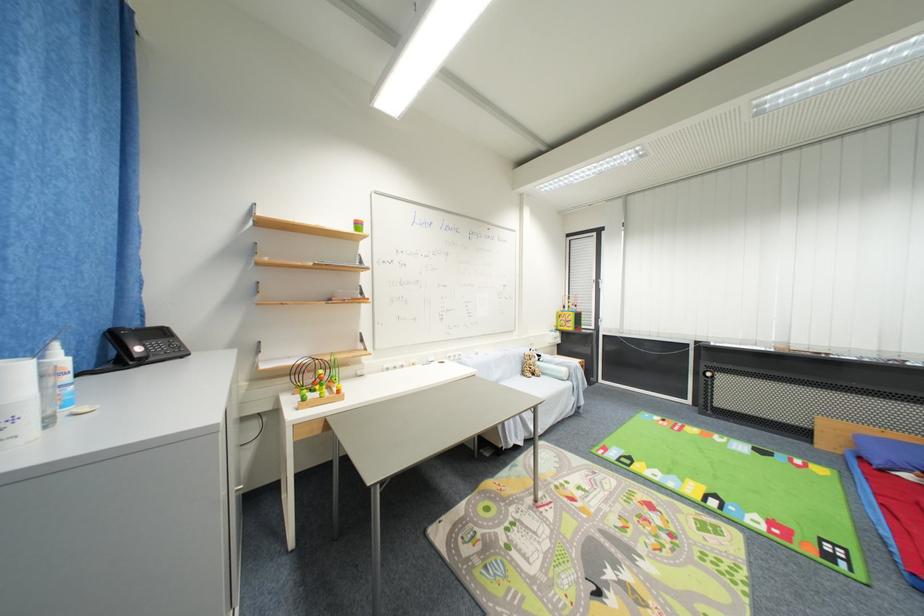
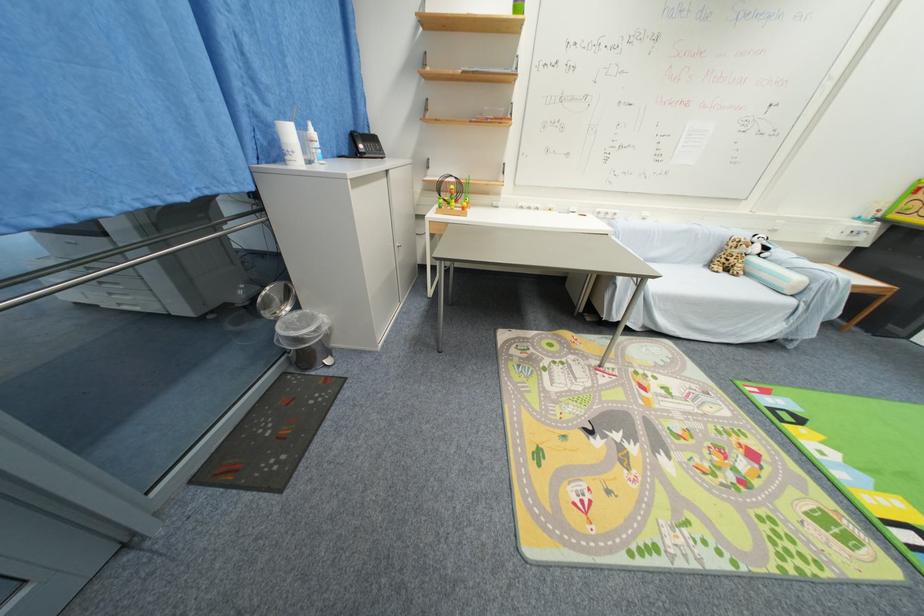
In the second image, find the point that corresponds to [528,376] in the first image.

(714, 265)